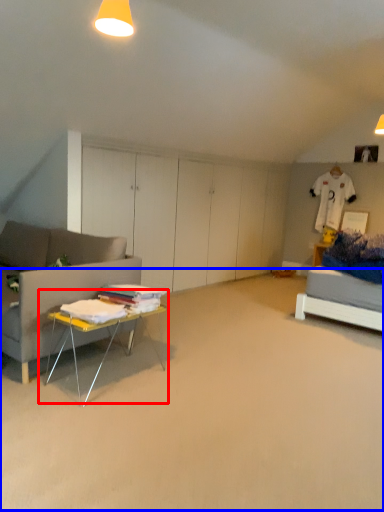
Question: Which point is further to the camera, table (highlighted by a red box) or plain (highlighted by a blue box)?

Choices:
 (A) table
 (B) plain

Answer: (A)